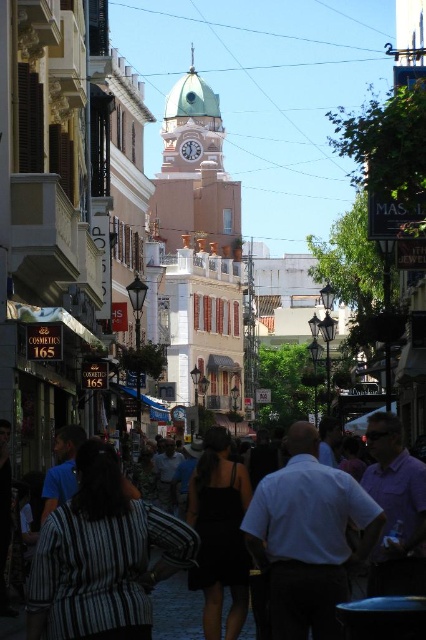
Question: Which of the following is the closest to the observer?

Choices:
 (A) black cotton shirt at center
 (B) light green dome at center

Answer: (A)

Question: Is light green dome at center bigger than black cotton shirt at center?

Choices:
 (A) yes
 (B) no

Answer: (A)

Question: Which point is farther from the camera taking this photo?

Choices:
 (A) (170, 636)
 (B) (227, 237)

Answer: (B)

Question: Does light green dome at center appear over black cotton shirt at center?

Choices:
 (A) yes
 (B) no

Answer: (A)

Question: Can you confirm if light green dome at center is smaller than black cotton shirt at center?

Choices:
 (A) no
 (B) yes

Answer: (A)